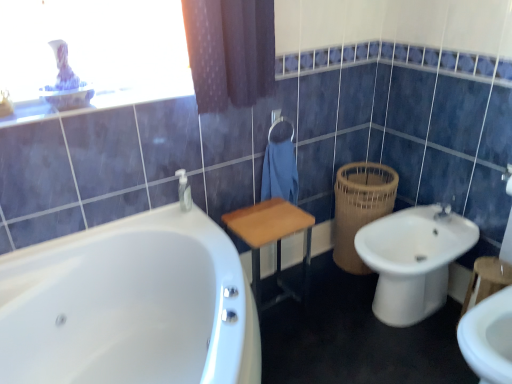
Locate an element on the screen. The height and width of the screenshot is (384, 512). blank space situated above wooden table at center (from a real-world perspective) is located at coordinates (272, 218).